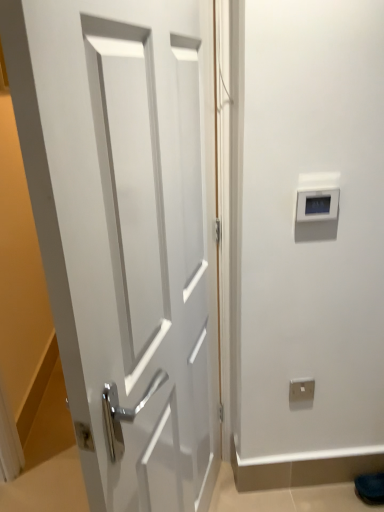
Question: From a real-world perspective, is white glossy door at center on white plastic electric outlet at lower center?

Choices:
 (A) yes
 (B) no

Answer: (A)

Question: Is white glossy door at center outside white plastic electric outlet at lower center?

Choices:
 (A) yes
 (B) no

Answer: (A)

Question: Is white glossy door at center far away from white plastic electric outlet at lower center?

Choices:
 (A) yes
 (B) no

Answer: (B)

Question: From a real-world perspective, does white glossy door at center sit lower than white plastic electric outlet at lower center?

Choices:
 (A) no
 (B) yes

Answer: (A)

Question: Does white glossy door at center appear on the right side of white plastic electric outlet at lower center?

Choices:
 (A) yes
 (B) no

Answer: (B)

Question: From the image's perspective, is white glossy door at center located above or below gray plastic thermostat at upper right?

Choices:
 (A) below
 (B) above

Answer: (A)

Question: From a real-world perspective, relative to gray plastic thermostat at upper right, is white glossy door at center vertically above or below?

Choices:
 (A) below
 (B) above

Answer: (A)

Question: Relative to gray plastic thermostat at upper right, is white glossy door at center in front or behind?

Choices:
 (A) front
 (B) behind

Answer: (A)

Question: Which is correct: white glossy door at center is inside gray plastic thermostat at upper right, or outside of it?

Choices:
 (A) outside
 (B) inside

Answer: (A)

Question: From the image's perspective, relative to white plastic electric outlet at lower center, is gray plastic thermostat at upper right above or below?

Choices:
 (A) above
 (B) below

Answer: (A)

Question: Looking at the image, does gray plastic thermostat at upper right seem bigger or smaller compared to white plastic electric outlet at lower center?

Choices:
 (A) small
 (B) big

Answer: (B)

Question: Considering the positions of point (299, 199) and point (301, 391), is point (299, 199) closer or farther from the camera than point (301, 391)?

Choices:
 (A) closer
 (B) farther

Answer: (A)

Question: Do you think gray plastic thermostat at upper right is within white plastic electric outlet at lower center, or outside of it?

Choices:
 (A) inside
 (B) outside

Answer: (B)

Question: From a real-world perspective, is gray plastic thermostat at upper right above or below white glossy door at center?

Choices:
 (A) below
 (B) above

Answer: (B)

Question: Is gray plastic thermostat at upper right wider or thinner than white glossy door at center?

Choices:
 (A) wide
 (B) thin

Answer: (B)